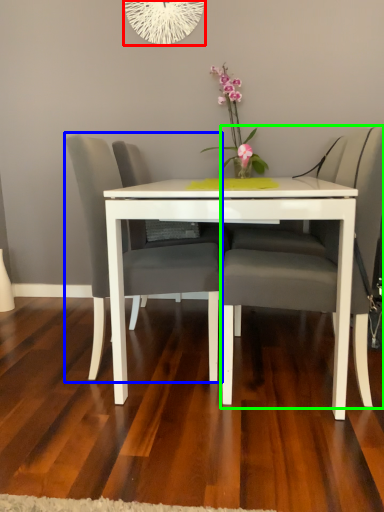
Question: Which is farther away from oval (highlighted by a red box)? chair (highlighted by a blue box) or chair (highlighted by a green box)?

Choices:
 (A) chair
 (B) chair

Answer: (B)